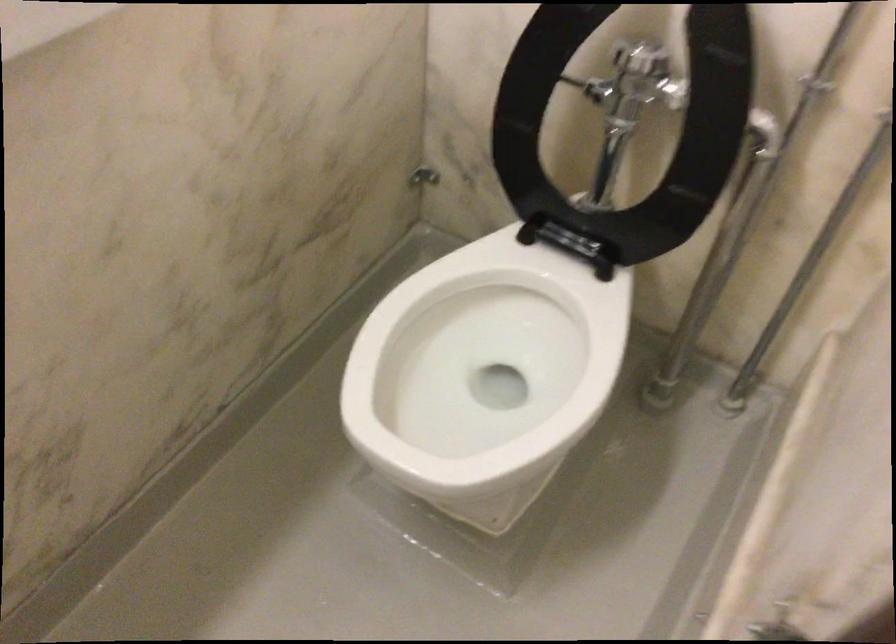
The image size is (896, 644). I want to click on toilet flush handle, so click(633, 82).